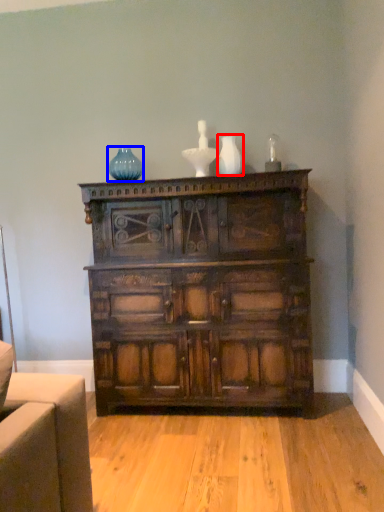
Question: Among these objects, which one is nearest to the camera, vase (highlighted by a red box) or glass vase (highlighted by a blue box)?

Choices:
 (A) vase
 (B) glass vase

Answer: (A)